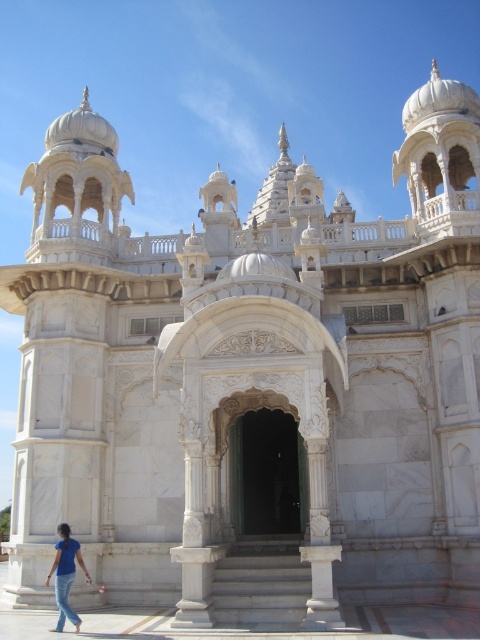
Question: Which point appears closest to the camera in this image?

Choices:
 (A) (266, 512)
 (B) (63, 593)

Answer: (B)

Question: Is white marble arch at center wider than blue denim jeans at lower left?

Choices:
 (A) no
 (B) yes

Answer: (B)

Question: Is white marble arch at center above blue denim jeans at lower left?

Choices:
 (A) yes
 (B) no

Answer: (A)

Question: Where is white marble arch at center located in relation to blue denim jeans at lower left in the image?

Choices:
 (A) right
 (B) left

Answer: (A)

Question: Which object is farther from the camera taking this photo?

Choices:
 (A) blue denim jeans at lower left
 (B) white marble arch at center

Answer: (B)

Question: Which point is farther to the camera?

Choices:
 (A) tap(81, 561)
 (B) tap(275, 413)

Answer: (B)